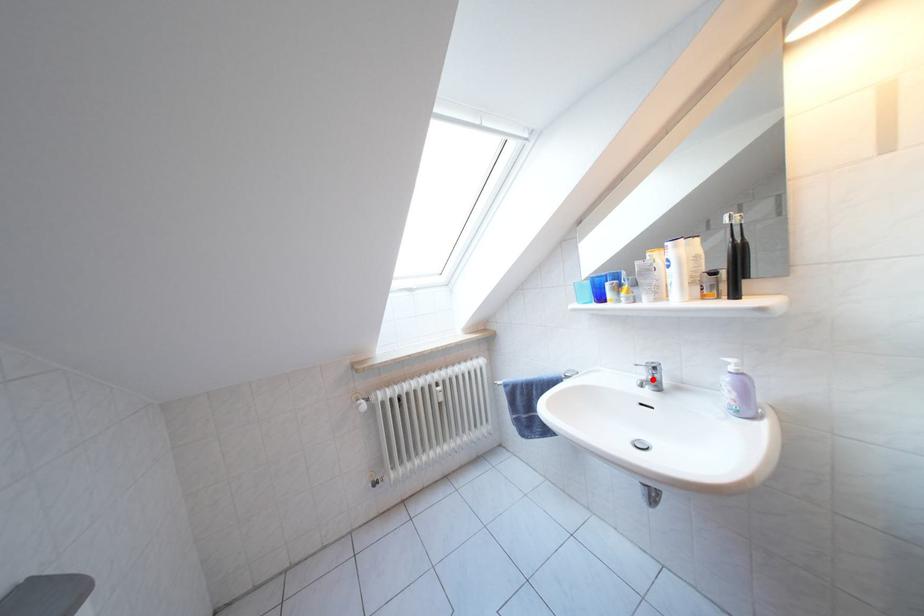
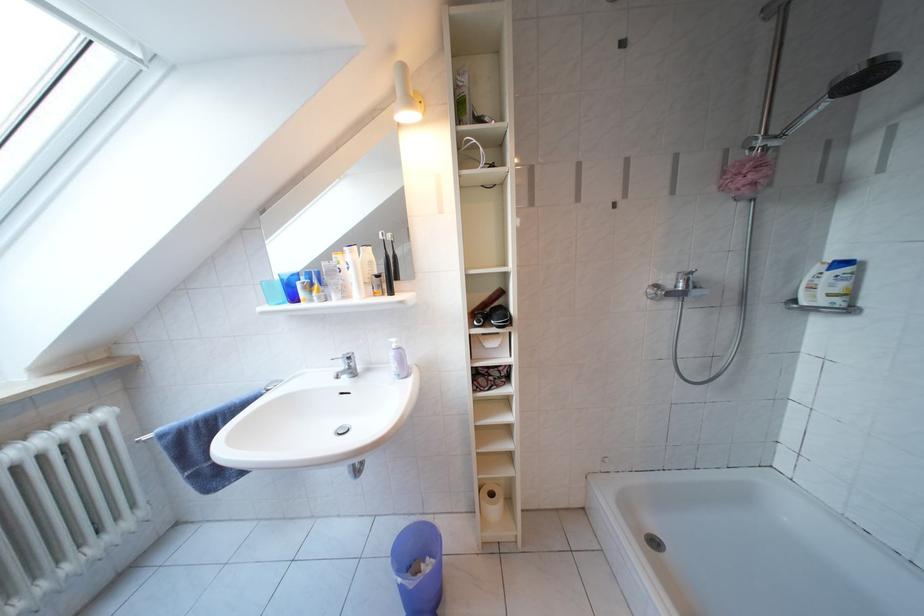
Question: I am providing you with two images of the same scene from different viewpoints. A red point is marked on the first image. Is the red point's position out of view in image 2?

Choices:
 (A) Yes
 (B) No

Answer: (B)